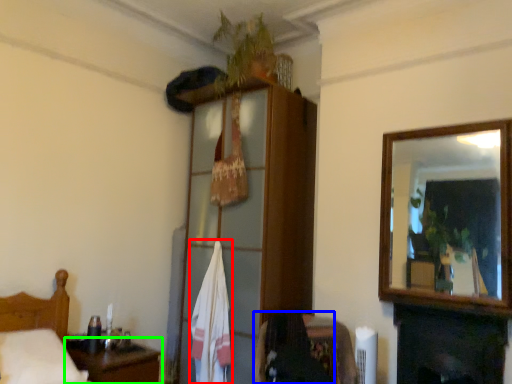
Question: Which object is positioned closest to bath towel (highlighted by a red box)? Select from chair (highlighted by a blue box) and table (highlighted by a green box).

Choices:
 (A) chair
 (B) table

Answer: (B)